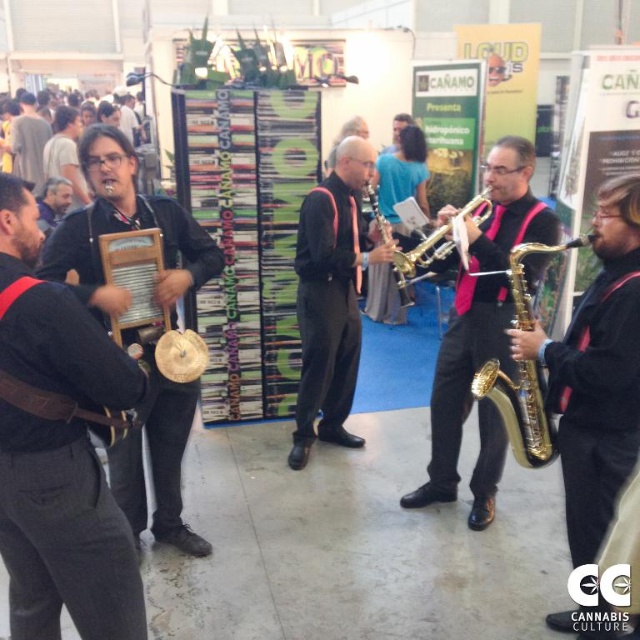
Between point (136, 465) and point (493, 184), which one is positioned behind?

Positioned behind is point (493, 184).

Who is positioned more to the left, wooden washboard at left or gold shiny saxophone at center?

wooden washboard at left is more to the left.

Is point (161, 525) positioned before point (404, 500)?

That is True.

Identify the location of wooden washboard at left. The height and width of the screenshot is (640, 640). (125, 224).

Who is positioned more to the right, black leather washboard at left or black matte saxophone at center?

black matte saxophone at center is more to the right.

Can you confirm if black leather washboard at left is wider than black matte saxophone at center?

Incorrect, black leather washboard at left's width does not surpass black matte saxophone at center's.

Which is in front, point (19, 412) or point (301, 301)?

Point (19, 412) is in front.

Identify the location of black leather washboard at left. This screenshot has width=640, height=640. (64, 532).

Consider the image. Can you confirm if matte black washboard at left is shorter than gold shiny trumpet at center?

Incorrect, matte black washboard at left's height does not fall short of gold shiny trumpet at center's.

Who is higher up, matte black washboard at left or gold shiny trumpet at center?

matte black washboard at left is higher up.

Is point (33, 122) positioned in front of point (467, 209)?

That is False.

I want to click on matte black washboard at left, so pyautogui.click(x=28, y=141).